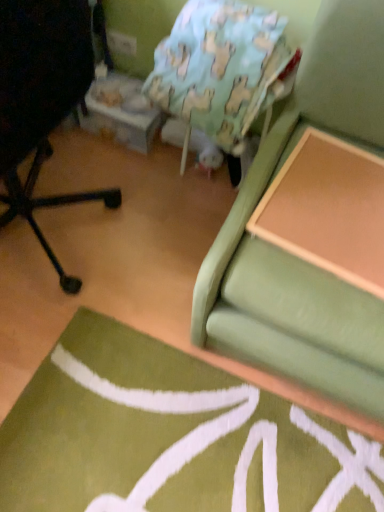
Question: Does black matte chair at left contain light blue fabric bean bag chair at upper center?

Choices:
 (A) yes
 (B) no

Answer: (B)

Question: Are black matte chair at left and light blue fabric bean bag chair at upper center far apart?

Choices:
 (A) yes
 (B) no

Answer: (B)

Question: Can you confirm if black matte chair at left is smaller than light blue fabric bean bag chair at upper center?

Choices:
 (A) no
 (B) yes

Answer: (A)

Question: Is black matte chair at left facing towards light blue fabric bean bag chair at upper center?

Choices:
 (A) yes
 (B) no

Answer: (B)

Question: Can you confirm if black matte chair at left is wider than light blue fabric bean bag chair at upper center?

Choices:
 (A) yes
 (B) no

Answer: (A)

Question: In terms of width, does wooden table at upper right look wider or thinner when compared to green fabric studio couch at upper right?

Choices:
 (A) thin
 (B) wide

Answer: (A)

Question: From the image's perspective, is wooden table at upper right positioned above or below green fabric studio couch at upper right?

Choices:
 (A) below
 (B) above

Answer: (B)

Question: Considering the positions of point (339, 272) and point (321, 329), is point (339, 272) closer or farther from the camera than point (321, 329)?

Choices:
 (A) farther
 (B) closer

Answer: (A)

Question: Is wooden table at upper right to the left or to the right of green fabric studio couch at upper right in the image?

Choices:
 (A) right
 (B) left

Answer: (B)

Question: Considering the positions of black matte chair at left and light blue fabric bean bag chair at upper center in the image, is black matte chair at left wider or thinner than light blue fabric bean bag chair at upper center?

Choices:
 (A) thin
 (B) wide

Answer: (B)

Question: Considering the relative positions of black matte chair at left and light blue fabric bean bag chair at upper center in the image provided, is black matte chair at left to the left or to the right of light blue fabric bean bag chair at upper center?

Choices:
 (A) right
 (B) left

Answer: (B)

Question: From a real-world perspective, is black matte chair at left above or below light blue fabric bean bag chair at upper center?

Choices:
 (A) above
 (B) below

Answer: (A)

Question: From the image's perspective, relative to light blue fabric bean bag chair at upper center, is black matte chair at left above or below?

Choices:
 (A) below
 (B) above

Answer: (A)

Question: From a real-world perspective, relative to black matte chair at left, is wooden table at upper right vertically above or below?

Choices:
 (A) above
 (B) below

Answer: (B)

Question: Is wooden table at upper right spatially inside black matte chair at left, or outside of it?

Choices:
 (A) outside
 (B) inside

Answer: (A)